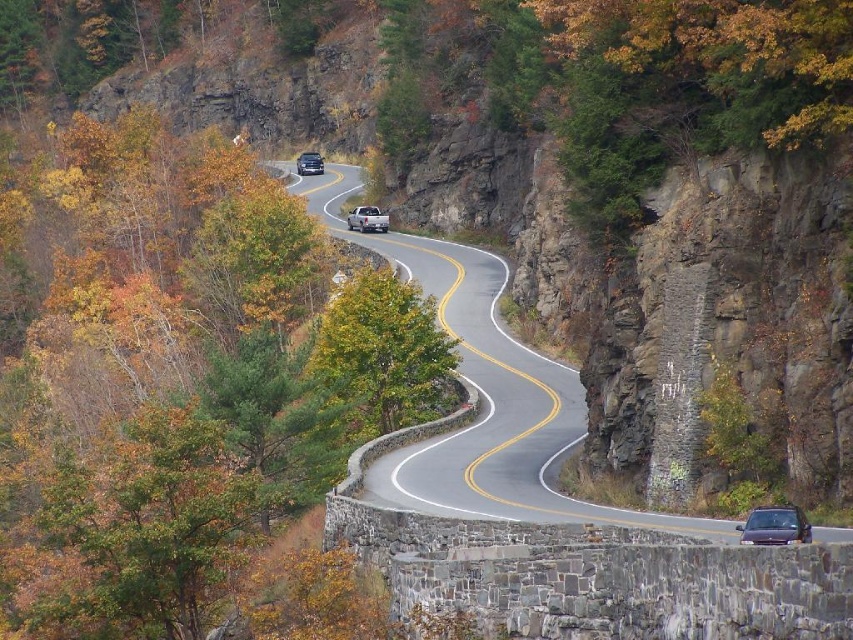
You are a delivery driver approaching the scenic mountain road. Your truck is a satin silver truck at center. The road ahead curves and is bordered by stone walls. You need to determine if your truck can safely navigate the upcoming curve. Given that the truck is 139.26 meters away from the camera, can you estimate whether the truck will fit through the curve without hitting the stone walls?

The satin silver truck at center is 139.26 meters away from the camera. However, the distance alone does not provide information about the width of the road or the curvature. Without knowing the road width or the curve radius, it is impossible to determine if the truck will fit through the curve without hitting the stone walls.